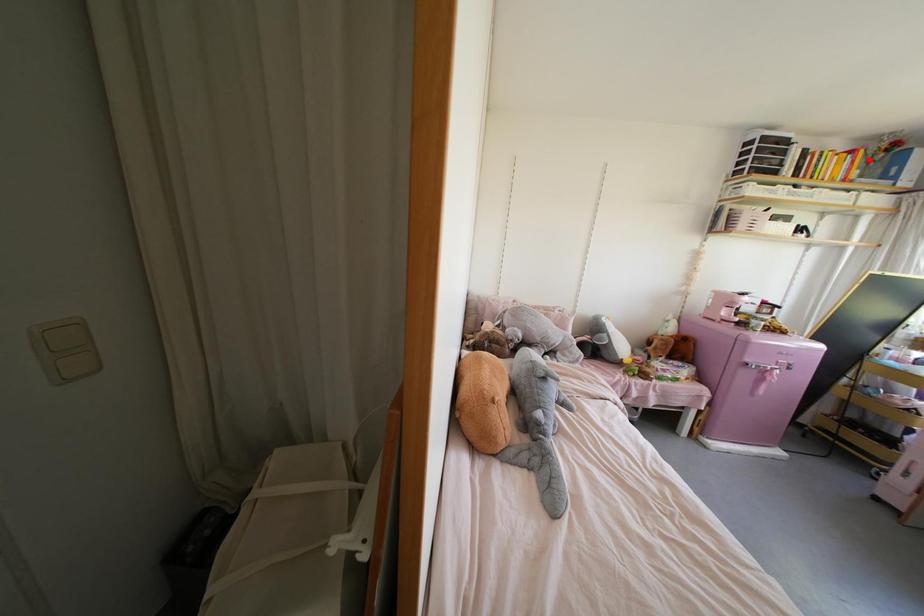
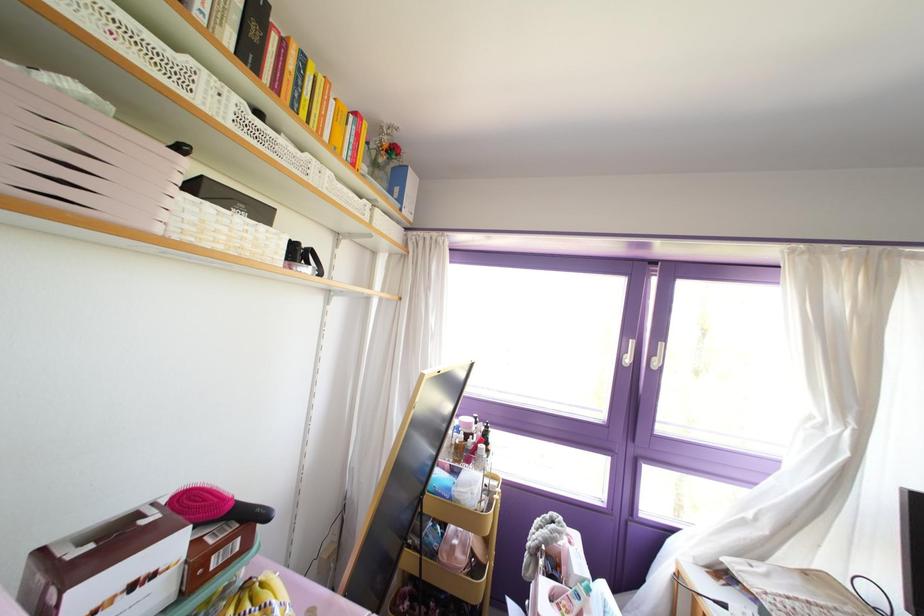
Question: I am providing you with two images of the same scene from different viewpoints. Given a red point in image1, look at the same physical point in image2. Is it:

Choices:
 (A) Closer to the viewpoint
 (B) Farther from the viewpoint

Answer: (A)